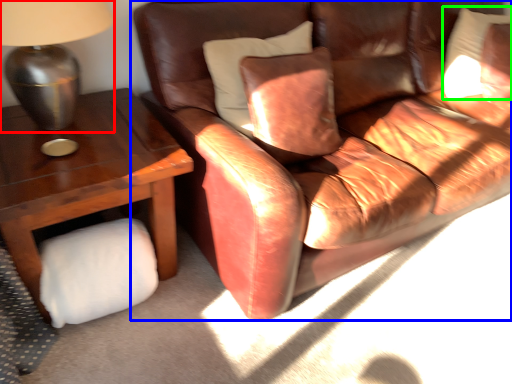
Question: Based on their relative distances, which object is farther from table lamp (highlighted by a red box)? Choose from studio couch (highlighted by a blue box) and pillow (highlighted by a green box).

Choices:
 (A) studio couch
 (B) pillow

Answer: (B)